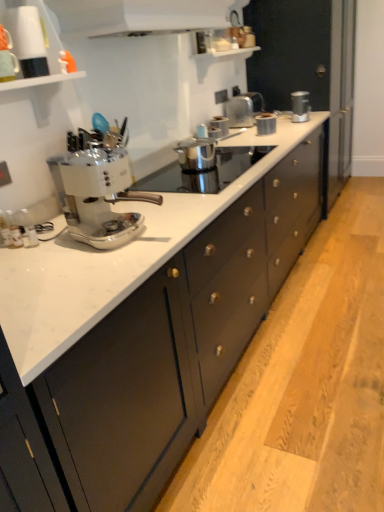
Question: Considering the relative positions of metallic silver toaster at upper right, positioned as the second kitchen appliance in left-to-right order, and metallic silver toaster at center, the 1th appliance from the front, in the image provided, is metallic silver toaster at upper right, positioned as the second kitchen appliance in left-to-right order, to the left of metallic silver toaster at center, the 1th appliance from the front, from the viewer's perspective?

Choices:
 (A) no
 (B) yes

Answer: (A)

Question: From the image's perspective, is metallic silver toaster at upper right, positioned as the second kitchen appliance in left-to-right order, on top of metallic silver toaster at center, the second appliance in the right-to-left sequence?

Choices:
 (A) no
 (B) yes

Answer: (B)

Question: Does metallic silver toaster at upper right, positioned as the second kitchen appliance in left-to-right order, have a smaller size compared to metallic silver toaster at center, the 2th appliance viewed from the top?

Choices:
 (A) no
 (B) yes

Answer: (A)

Question: Could you tell me if metallic silver toaster at upper right, the first kitchen appliance when ordered from right to left, is turned towards metallic silver toaster at center, the 2th appliance viewed from the top?

Choices:
 (A) yes
 (B) no

Answer: (B)

Question: Considering the relative sizes of metallic silver toaster at upper right, the first kitchen appliance when ordered from right to left, and metallic silver toaster at center, the second appliance in the right-to-left sequence, in the image provided, is metallic silver toaster at upper right, the first kitchen appliance when ordered from right to left, wider than metallic silver toaster at center, the second appliance in the right-to-left sequence,?

Choices:
 (A) yes
 (B) no

Answer: (B)

Question: From a real-world perspective, is metallic silver toaster at upper right, positioned as the 1th kitchen appliance in back-to-front order, on metallic silver toaster at center, the 1th appliance from the bottom?

Choices:
 (A) no
 (B) yes

Answer: (B)

Question: Can you confirm if white glossy mug at upper left is smaller than metallic silver toaster at upper center, which appears as the second kitchen appliance when viewed from the top?

Choices:
 (A) no
 (B) yes

Answer: (A)

Question: From the image's perspective, would you say white glossy mug at upper left is shown under metallic silver toaster at upper center, which is counted as the second kitchen appliance, starting from the back?

Choices:
 (A) no
 (B) yes

Answer: (B)

Question: Considering the relative positions of white glossy mug at upper left and metallic silver toaster at upper center, acting as the 1th kitchen appliance starting from the bottom, in the image provided, is white glossy mug at upper left to the left of metallic silver toaster at upper center, acting as the 1th kitchen appliance starting from the bottom, from the viewer's perspective?

Choices:
 (A) no
 (B) yes

Answer: (B)

Question: Considering the relative sizes of white glossy mug at upper left and metallic silver toaster at upper center, arranged as the first kitchen appliance when viewed from the left, in the image provided, is white glossy mug at upper left wider than metallic silver toaster at upper center, arranged as the first kitchen appliance when viewed from the left,?

Choices:
 (A) no
 (B) yes

Answer: (A)

Question: Does white glossy mug at upper left have a greater height compared to metallic silver toaster at upper center, which appears as the second kitchen appliance when viewed from the top?

Choices:
 (A) yes
 (B) no

Answer: (A)

Question: Is white glossy mug at upper left placed right next to metallic silver toaster at upper center, arranged as the first kitchen appliance when viewed from the left?

Choices:
 (A) yes
 (B) no

Answer: (B)

Question: Is white glossy range hood at upper center not inside matte black cabinets at center?

Choices:
 (A) yes
 (B) no

Answer: (A)